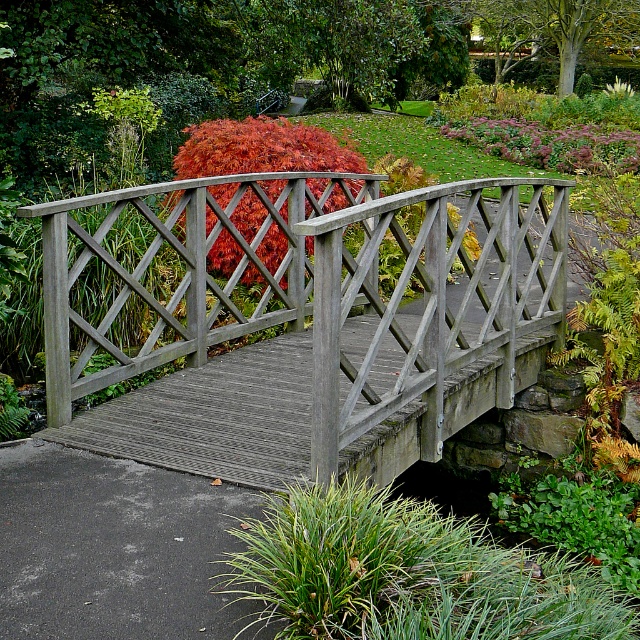
Question: Is wooden bridge at center to the left of vivid red foliage at center from the viewer's perspective?

Choices:
 (A) yes
 (B) no

Answer: (B)

Question: Can you confirm if black asphalt path at lower left is wider than vivid red foliage at center?

Choices:
 (A) yes
 (B) no

Answer: (B)

Question: Considering the real-world distances, which object is closest to the wooden bridge at center?

Choices:
 (A) vivid red foliage at center
 (B) black asphalt path at lower left

Answer: (B)

Question: Can you confirm if wooden bridge at center is positioned to the right of vivid red foliage at center?

Choices:
 (A) yes
 (B) no

Answer: (A)

Question: Which object is the closest to the wooden bridge at center?

Choices:
 (A) vivid red foliage at center
 (B) black asphalt path at lower left

Answer: (B)

Question: Among these objects, which one is nearest to the camera?

Choices:
 (A) black asphalt path at lower left
 (B) vivid red foliage at center

Answer: (A)